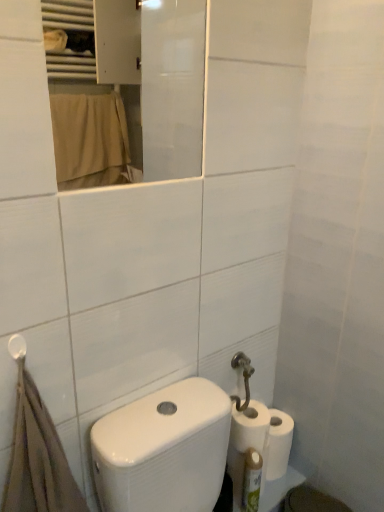
Question: Can you confirm if white matte toilet paper at lower right, which is counted as the first toilet paper, starting from the top, is bigger than green plastic bottle at lower right?

Choices:
 (A) yes
 (B) no

Answer: (A)

Question: Can you confirm if white matte toilet paper at lower right, the third toilet paper when ordered from bottom to top, is wider than green plastic bottle at lower right?

Choices:
 (A) yes
 (B) no

Answer: (A)

Question: Does white matte toilet paper at lower right, the third toilet paper when ordered from bottom to top, have a lesser width compared to green plastic bottle at lower right?

Choices:
 (A) no
 (B) yes

Answer: (A)

Question: Is white matte toilet paper at lower right, the third toilet paper when ordered from bottom to top, at the left side of green plastic bottle at lower right?

Choices:
 (A) yes
 (B) no

Answer: (A)

Question: Is the position of white matte toilet paper at lower right, the third toilet paper when ordered from bottom to top, less distant than that of green plastic bottle at lower right?

Choices:
 (A) no
 (B) yes

Answer: (A)

Question: Based on their positions, is white matte toilet paper at lower right, which is counted as the second toilet paper, starting from the top, located to the left or right of brown cotton bath towel at lower left?

Choices:
 (A) right
 (B) left

Answer: (A)

Question: From a real-world perspective, relative to brown cotton bath towel at lower left, is white matte toilet paper at lower right, the 2th toilet paper positioned from the bottom, vertically above or below?

Choices:
 (A) below
 (B) above

Answer: (A)

Question: From the image's perspective, is white matte toilet paper at lower right, the 2th toilet paper positioned from the bottom, positioned above or below brown cotton bath towel at lower left?

Choices:
 (A) below
 (B) above

Answer: (A)

Question: Considering the positions of white matte toilet paper at lower right, which is counted as the second toilet paper, starting from the top, and brown cotton bath towel at lower left in the image, is white matte toilet paper at lower right, which is counted as the second toilet paper, starting from the top, taller or shorter than brown cotton bath towel at lower left?

Choices:
 (A) short
 (B) tall

Answer: (A)

Question: From their relative heights in the image, would you say brown cotton bath towel at lower left is taller or shorter than white glossy mirror at upper center?

Choices:
 (A) short
 (B) tall

Answer: (B)

Question: Is brown cotton bath towel at lower left to the left or to the right of white glossy mirror at upper center in the image?

Choices:
 (A) left
 (B) right

Answer: (A)

Question: From a real-world perspective, is brown cotton bath towel at lower left physically located above or below white glossy mirror at upper center?

Choices:
 (A) above
 (B) below

Answer: (B)

Question: In terms of width, does brown cotton bath towel at lower left look wider or thinner when compared to white glossy mirror at upper center?

Choices:
 (A) thin
 (B) wide

Answer: (B)

Question: From a real-world perspective, is white matte toilet paper at lower right, placed as the third toilet paper when sorted from top to bottom, positioned above or below white glossy mirror at upper center?

Choices:
 (A) above
 (B) below

Answer: (B)

Question: Relative to white glossy mirror at upper center, is white matte toilet paper at lower right, placed as the 1th toilet paper when sorted from bottom to top, in front or behind?

Choices:
 (A) behind
 (B) front

Answer: (A)